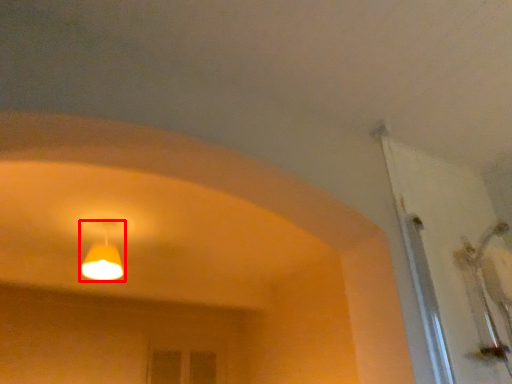
Question: From the image's perspective, what is the correct spatial relationship of lamp (annotated by the red box) in relation to door?

Choices:
 (A) above
 (B) below

Answer: (B)